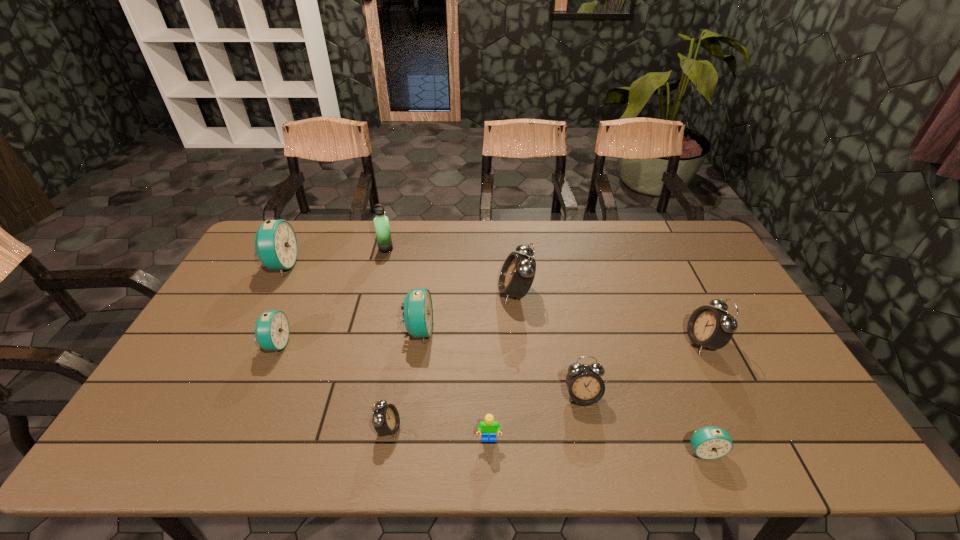
Locate an element on the screen. The height and width of the screenshot is (540, 960). vacant point located on the face of the seventh object from left to right is located at coordinates (420, 293).

Locate an element on the screen. This screenshot has width=960, height=540. vacant space located on the face of the seventh object from left to right is located at coordinates (469, 293).

At what (x,y) coordinates should I click in order to perform the action: click on vacant space situated on the face of the seventh object from left to right. Please return your answer as a coordinate pair (x, y). Looking at the image, I should click on (473, 293).

Where is `free region located on the face of the rightmost white alarm clock`? free region located on the face of the rightmost white alarm clock is located at coordinates (634, 342).

At what (x,y) coordinates should I click in order to perform the action: click on free space located on the face of the rightmost white alarm clock. Please return your answer as a coordinate pair (x, y). The width and height of the screenshot is (960, 540). Looking at the image, I should click on (609, 342).

At what (x,y) coordinates should I click in order to perform the action: click on blank space located on the face of the rightmost white alarm clock. Please return your answer as a coordinate pair (x, y). Looking at the image, I should click on (570, 342).

You are a GUI agent. You are given a task and a screenshot of the screen. Output one action in this format:
    pyautogui.click(x=<x>, y=<y>)
    Task: Click on the blank area located 0.200m on the front-facing side of the second blue alarm clock from right to left
    The height and width of the screenshot is (540, 960).
    Given the screenshot: What is the action you would take?
    pyautogui.click(x=502, y=330)

Where is `vacant position located 0.330m on the front-facing side of the second blue alarm clock from left to right`? vacant position located 0.330m on the front-facing side of the second blue alarm clock from left to right is located at coordinates (405, 345).

Identify the location of vacant space situated on the face of the second nearest white alarm clock. (589, 431).

You are a GUI agent. You are given a task and a screenshot of the screen. Output one action in this format:
    pyautogui.click(x=<x>, y=<y>)
    Task: Click on the vacant region located 0.100m on the face of the nearest white alarm clock
    
    Given the screenshot: What is the action you would take?
    pyautogui.click(x=443, y=428)